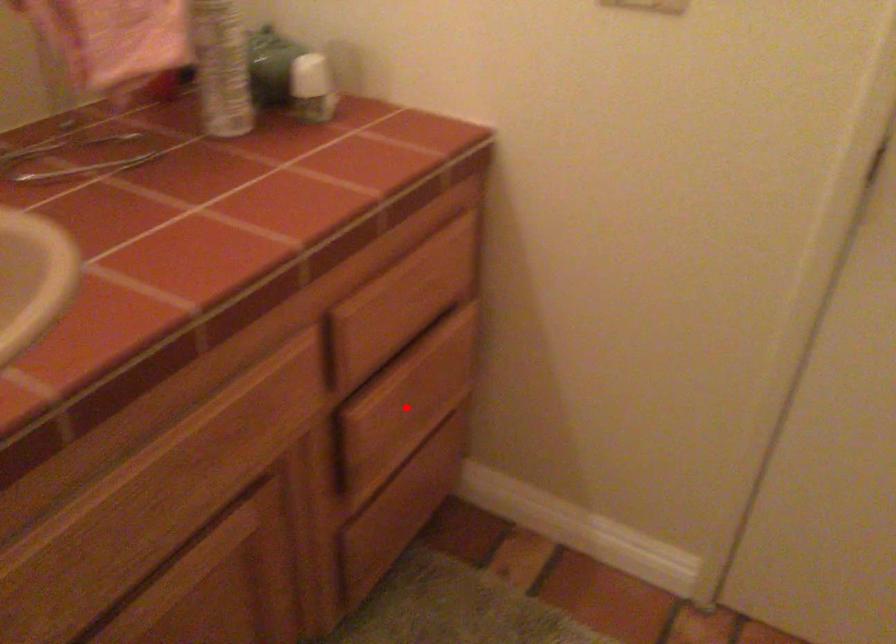
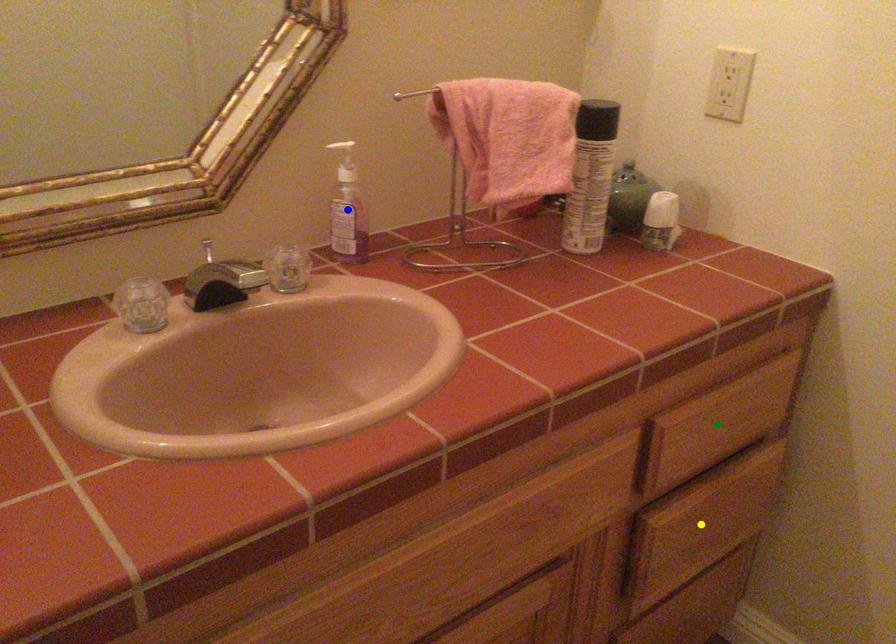
Question: I am providing you with two images of the same scene from different viewpoints. A red point is marked on the first image. You are given multiple points on the second image. Which mark in image 2 goes with the point in image 1?

Choices:
 (A) blue point
 (B) yellow point
 (C) green point

Answer: (B)